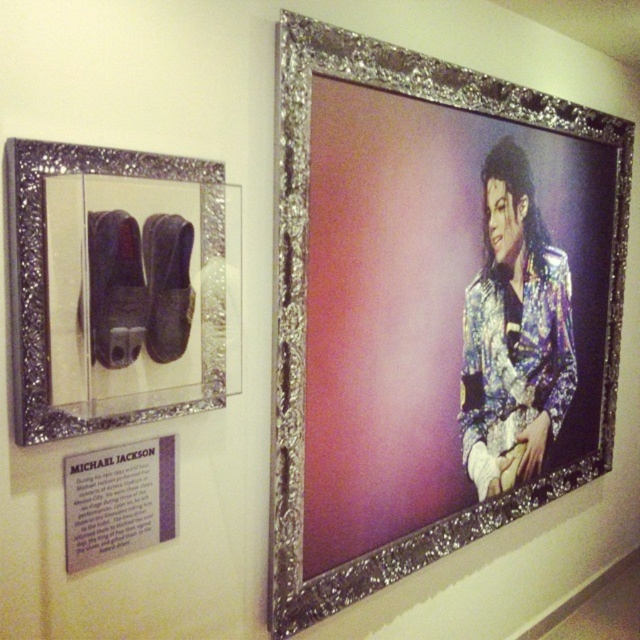
Can you confirm if silver glitter shoes at left is thinner than suede-like leather shoe at left?

In fact, silver glitter shoes at left might be wider than suede-like leather shoe at left.

Is silver glitter shoes at left to the right of suede-like leather shoe at left from the viewer's perspective?

Yes, silver glitter shoes at left is to the right of suede-like leather shoe at left.

Which is behind, point (92, 403) or point (122, 317)?

The point (122, 317) is more distant.

The image size is (640, 640). I want to click on silver glitter shoes at left, so click(45, 280).

Is the position of shiny metallic jacket at center-right less distant than that of silver glitter shoes at left?

No, it is behind silver glitter shoes at left.

Does shiny metallic jacket at center-right come behind silver glitter shoes at left?

Yes, it is behind silver glitter shoes at left.

Between point (486, 225) and point (28, 266), which one is positioned in front?

Point (28, 266) is in front.

Locate an element on the screen. This screenshot has height=640, width=640. shiny metallic jacket at center-right is located at coordinates (515, 333).

Who is positioned more to the left, shiny metallic jacket at center-right or suede-like leather shoe at left?

suede-like leather shoe at left

Between point (524, 204) and point (124, 275), which one is positioned in front?

Point (124, 275)

Who is more forward, (564,330) or (99,321)?

Point (99,321) is in front.

At what (x,y) coordinates should I click in order to perform the action: click on shiny metallic jacket at center-right. Please return your answer as a coordinate pair (x, y). Image resolution: width=640 pixels, height=640 pixels. Looking at the image, I should click on (515, 333).